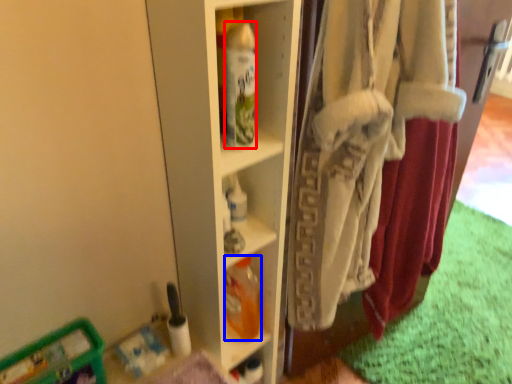
Question: Among these objects, which one is nearest to the camera, bottle (highlighted by a red box) or bottle (highlighted by a blue box)?

Choices:
 (A) bottle
 (B) bottle

Answer: (A)